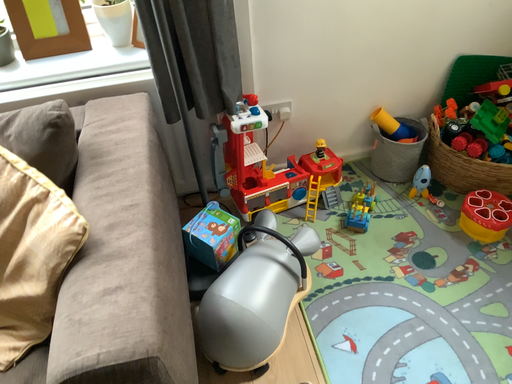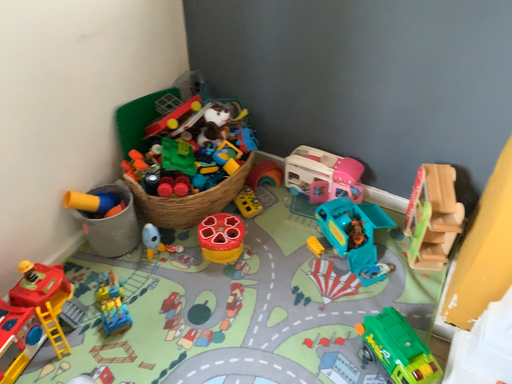
Question: Which way did the camera rotate in the video?

Choices:
 (A) rotated upward
 (B) rotated downward

Answer: (A)